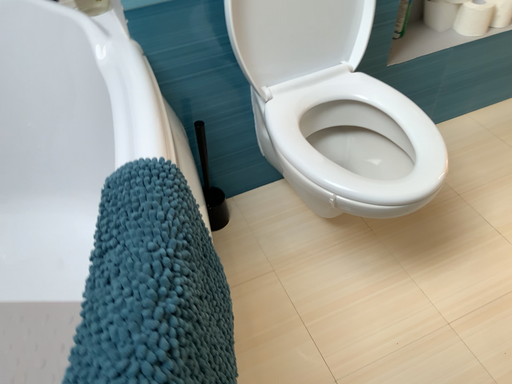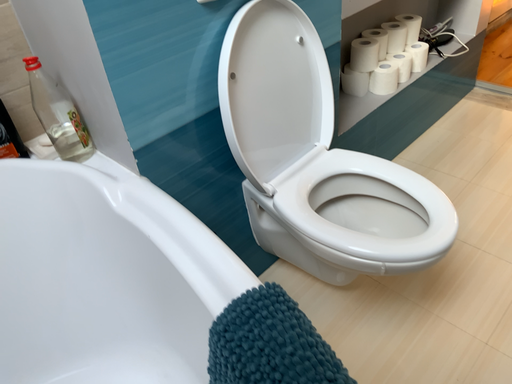
Question: Which way did the camera rotate in the video?

Choices:
 (A) rotated left
 (B) rotated right

Answer: (B)